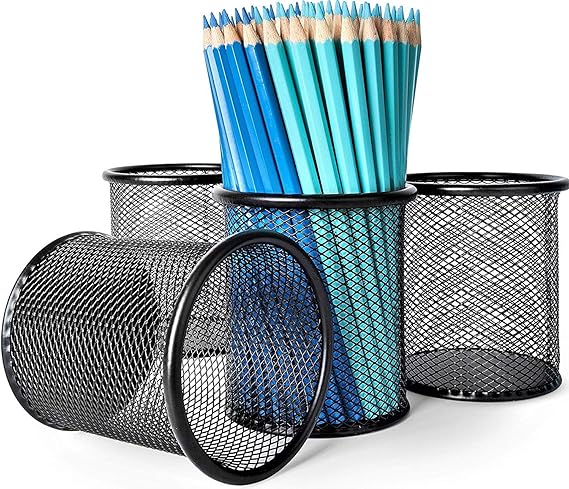
You are a GUI agent. You are given a task and a screenshot of the screen. Output one action in this format:
    pyautogui.click(x=<x>, y=<y>)
    Task: Click on the mesh metal sides of bins
    The image size is (569, 489).
    Given the screenshot: What is the action you would take?
    pyautogui.click(x=130, y=407), pyautogui.click(x=479, y=273), pyautogui.click(x=395, y=216), pyautogui.click(x=181, y=196)